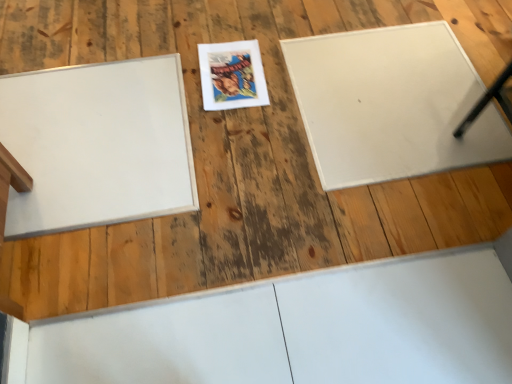
Find the location of a particular element. vacant space underneath white matte board at upper right, which is the 2th bulletin board in left-to-right order (from a real-world perspective) is located at coordinates (387, 95).